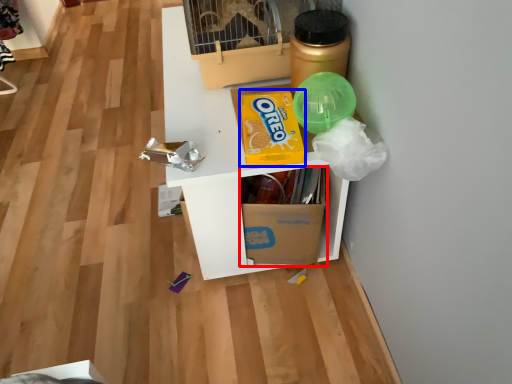
Question: Which of the following is the closest to the observer, cardboard box (highlighted by a red box) or cereal (highlighted by a blue box)?

Choices:
 (A) cardboard box
 (B) cereal

Answer: (B)